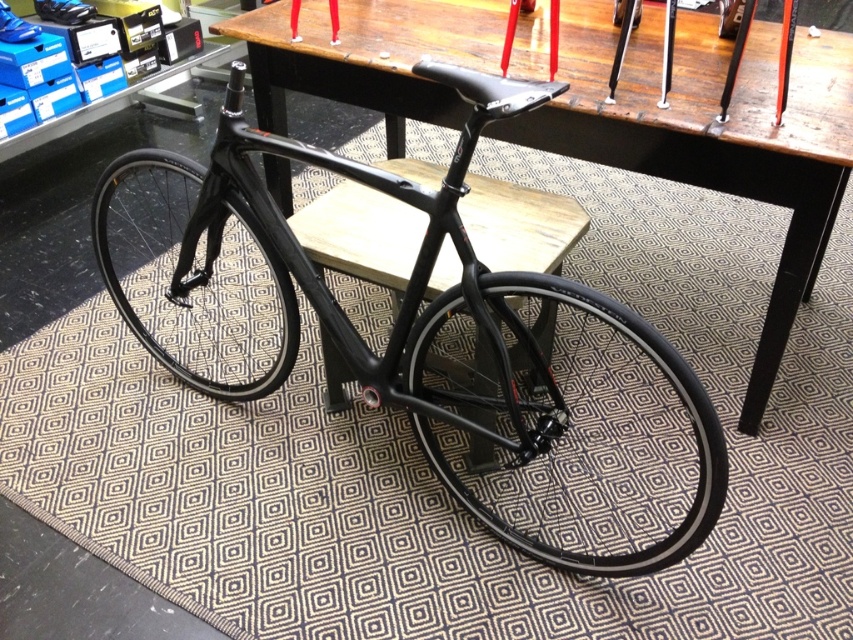
You are an interior designer planning to place a new rug in the showroom. The current rug is under the black matte bicycle at center and the wooden table at center. Since you want the rug to cover both objects completely, which object requires a wider rug based on their sizes?

The black matte bicycle at center requires a wider rug because its width is larger than the wooden table at center.

What is the location of the point with coordinates [428,342] in the image?

The point with coordinates [428,342] is located on the black matte bicycle at center.

From the picture: You are a delivery person trying to move the black matte bicycle at center and the wooden table at center out of the room. Which object will require more space to maneuver due to its size?

The black matte bicycle at center is larger in size than the wooden table at center, so it will require more space to maneuver.